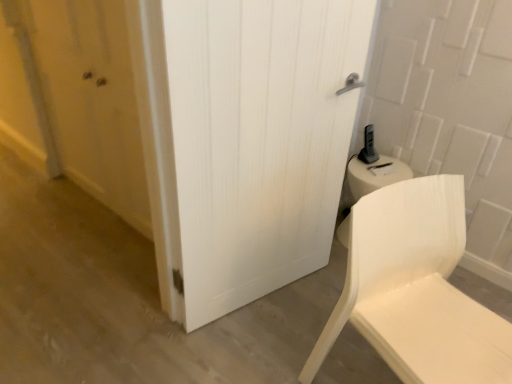
At what (x,y) coordinates should I click in order to perform the action: click on free space to the left of matte wooden door at left. Please return your answer as a coordinate pair (x, y). This screenshot has width=512, height=384. Looking at the image, I should click on (48, 214).